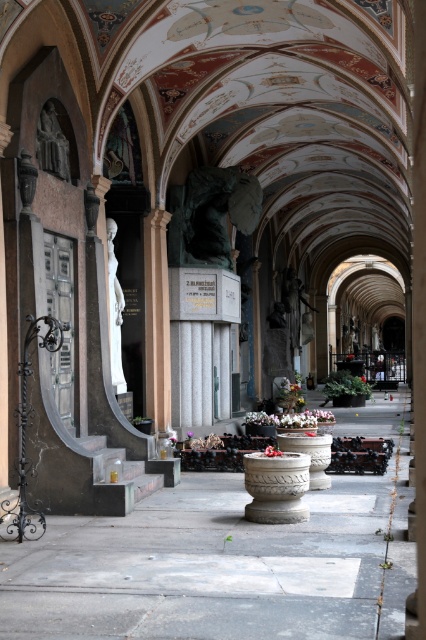
Question: Can you confirm if green bronze statue at center is positioned below matte stone statue at left?

Choices:
 (A) no
 (B) yes

Answer: (B)

Question: Which point is farther to the camera?

Choices:
 (A) white marble statue at left
 (B) green bronze statue at center
 (C) matte stone statue at left

Answer: (B)

Question: Is green bronze statue at center below matte stone statue at left?

Choices:
 (A) yes
 (B) no

Answer: (A)

Question: Which of the following is the closest to the observer?

Choices:
 (A) (184, 225)
 (B) (115, 365)

Answer: (B)

Question: Does green bronze statue at center appear on the left side of white marble statue at left?

Choices:
 (A) no
 (B) yes

Answer: (A)

Question: Estimate the real-world distances between objects in this image. Which object is closer to the white marble statue at left?

Choices:
 (A) matte stone statue at left
 (B) green bronze statue at center

Answer: (A)